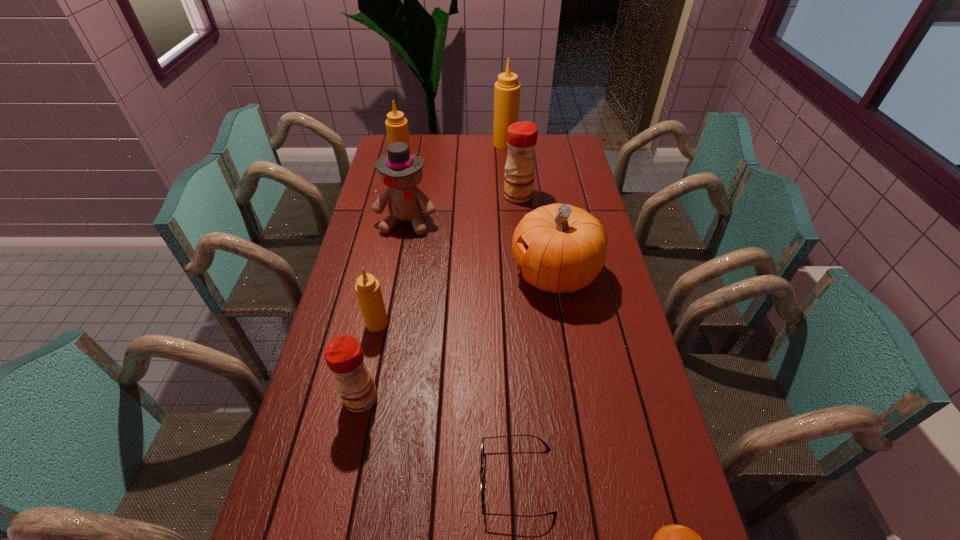
The image size is (960, 540). I want to click on free spot at the far edge of the desktop, so (x=457, y=153).

In order to click on vacant region at the right edge of the desktop in this screenshot , I will do `click(573, 189)`.

This screenshot has width=960, height=540. In order to click on free space at the far right corner of the desktop in this screenshot , I will do `click(555, 137)`.

Locate an element on the screen. free space between the nearer red condiment and the spectacles is located at coordinates (439, 438).

Locate an element on the screen. Image resolution: width=960 pixels, height=540 pixels. free space between the nearest condiment and the farther red condiment is located at coordinates point(440,296).

Identify the location of vacant area between the tallest condiment and the fifth farthest object. (530, 209).

The width and height of the screenshot is (960, 540). I want to click on free area in between the fifth farthest object and the nearest tan condiment, so click(466, 299).

You are a GUI agent. You are given a task and a screenshot of the screen. Output one action in this format:
    pyautogui.click(x=<x>, y=<y>)
    Task: Click on the free space between the sixth farthest object and the spectacles
    
    Given the screenshot: What is the action you would take?
    pyautogui.click(x=446, y=401)

Where is `unoccupied area between the tallest condiment and the fifth nearest object`? Image resolution: width=960 pixels, height=540 pixels. unoccupied area between the tallest condiment and the fifth nearest object is located at coordinates (530, 209).

Where is `free point between the farther red condiment and the nearest condiment`? Image resolution: width=960 pixels, height=540 pixels. free point between the farther red condiment and the nearest condiment is located at coordinates (440, 296).